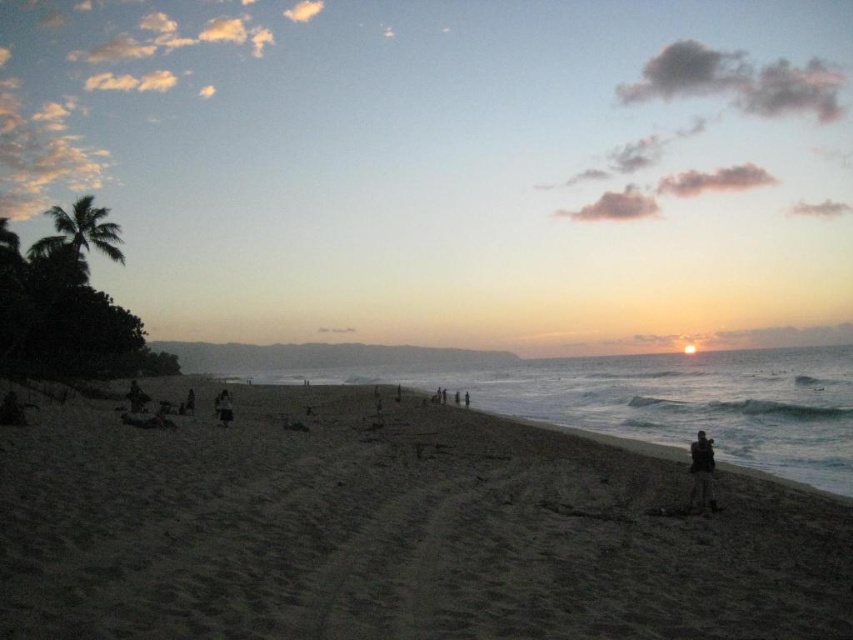
You are standing on the beach and want to walk towards the dark gray fabric person at lower right. Which direction should you move to avoid stepping on the dark sand at beach right?

To avoid stepping on the dark sand at beach right, move behind the dark gray fabric person at lower right since the dark sand at beach right is in front of them.